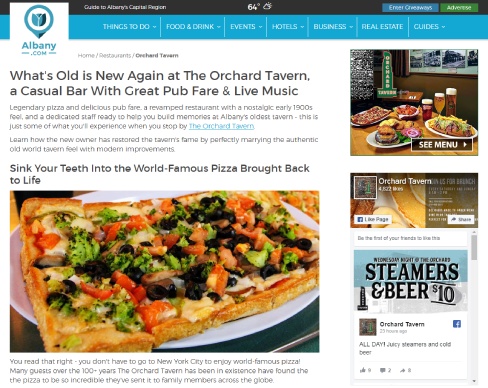
The width and height of the screenshot is (488, 388). I want to click on white porcelain server plate, so click(231, 332), click(270, 317), click(310, 211), click(108, 196), click(25, 306).